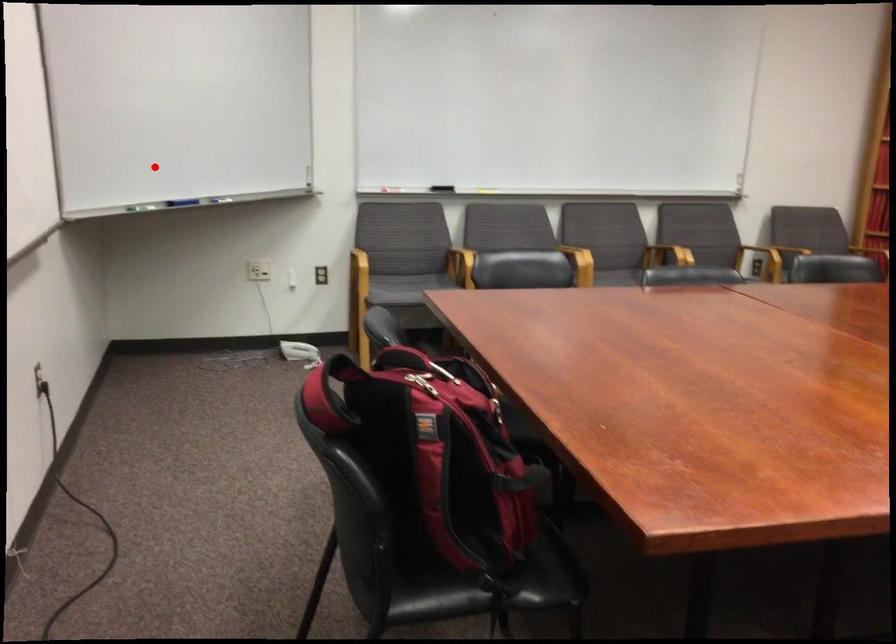
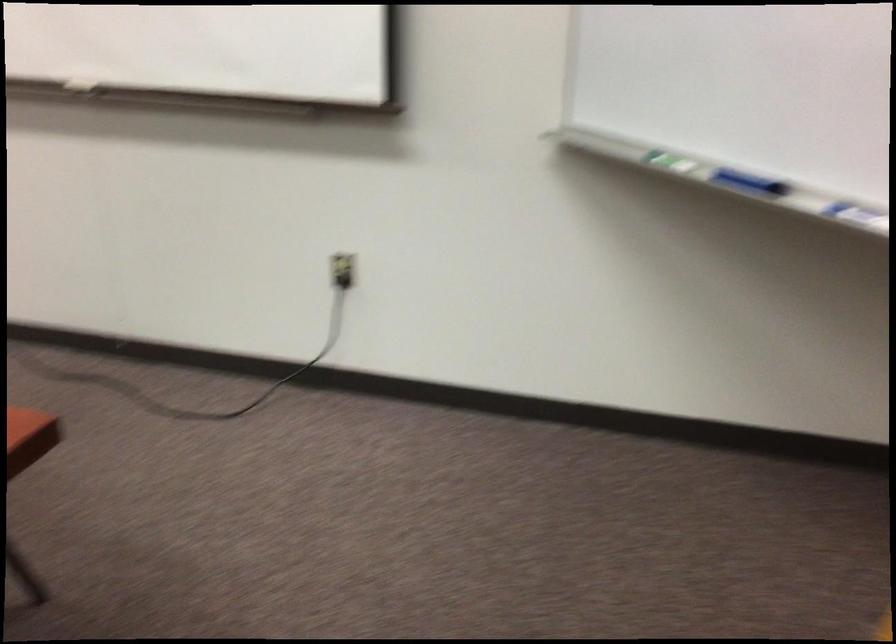
Question: A red point is marked in image1. In image2, is the corresponding 3D point closer to the camera or farther? Reply with the corresponding letter.

Choices:
 (A) The corresponding 3D point is closer.
 (B) The corresponding 3D point is farther.

Answer: (A)